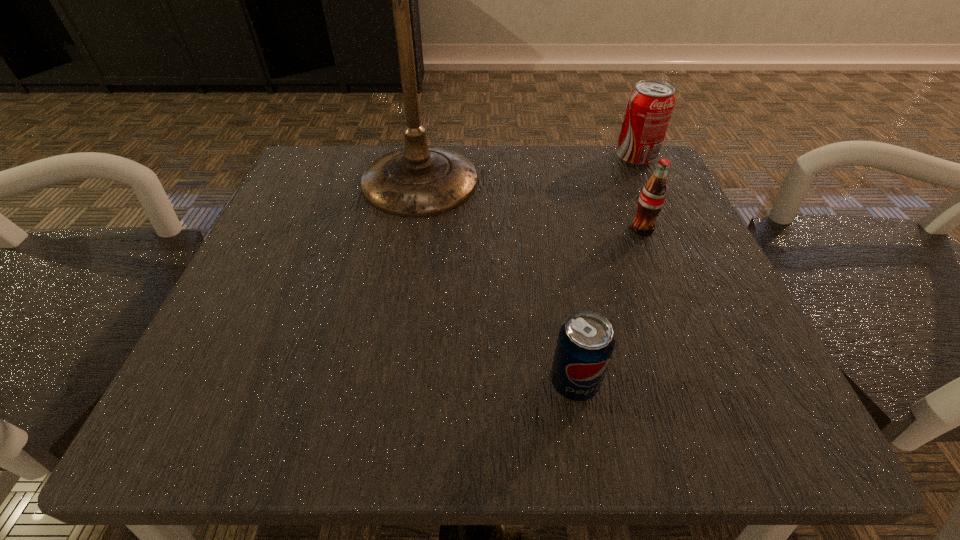
Identify the location of unoccupied area between the shortest object and the second nearest soda can. The width and height of the screenshot is (960, 540). (608, 306).

Locate an element on the screen. The height and width of the screenshot is (540, 960). vacant region between the second nearest soda can and the shortest soda can is located at coordinates (608, 306).

Locate an element on the screen. The image size is (960, 540). free space between the nearest object and the second farthest soda can is located at coordinates click(x=608, y=306).

Locate which object is the third closest to the second nearest soda can. Please provide its 2D coordinates. Your answer should be formatted as a tuple, i.e. [(x, y)], where the tuple contains the x and y coordinates of a point satisfying the conditions above.

[(585, 344)]

Identify the location of the closest object relative to the leftmost object. This screenshot has height=540, width=960. (652, 198).

The height and width of the screenshot is (540, 960). In order to click on the closest soda can to the shortest object in this screenshot , I will do `click(652, 198)`.

The width and height of the screenshot is (960, 540). Find the location of `soda can that is the closest to the second nearest soda can`. soda can that is the closest to the second nearest soda can is located at coordinates (650, 105).

Locate an element on the screen. The image size is (960, 540). blank space that satisfies the following two spatial constraints: 1. on the back side of the nearest object; 2. on the right side of the second nearest soda can is located at coordinates (548, 229).

Where is `free space that satisfies the following two spatial constraints: 1. above the green lampshade of the leftmost soda can; 2. on the left side of the leftmost object`? The image size is (960, 540). free space that satisfies the following two spatial constraints: 1. above the green lampshade of the leftmost soda can; 2. on the left side of the leftmost object is located at coordinates (387, 383).

Identify the location of free space that satisfies the following two spatial constraints: 1. above the green lampshade of the leftmost object; 2. on the right side of the second nearest soda can. This screenshot has width=960, height=540. (413, 229).